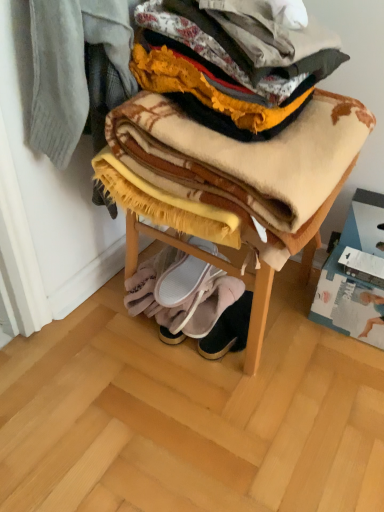
At what (x,y) coordinates should I click in order to perform the action: click on soft yellow fleece blanket at lower center, which is the 2th blanket from top to bottom. Please return your answer as a coordinate pair (x, y). Image resolution: width=384 pixels, height=512 pixels. Looking at the image, I should click on (181, 292).

What do you see at coordinates (230, 67) in the screenshot?
I see `plaid woolen blanket at center, acting as the 1th blanket starting from the top` at bounding box center [230, 67].

This screenshot has width=384, height=512. What do you see at coordinates (213, 306) in the screenshot?
I see `white fabric slipper at lower center, which ranks as the second footwear in bottom-to-top order` at bounding box center [213, 306].

At what (x,y) coordinates should I click in order to perform the action: click on soft yellow fleece blanket at lower center, which is the 2th blanket from top to bottom. Please return your answer as a coordinate pair (x, y). The image size is (384, 512). Looking at the image, I should click on (181, 292).

Considering the positions of points (205, 301) and (242, 310), is point (205, 301) closer to camera compared to point (242, 310)?

Yes, point (205, 301) is in front of point (242, 310).

From a real-world perspective, is white fabric slipper at lower center, which ranks as the second footwear in bottom-to-top order, above or below leather suede booties at lower center, positioned as the 1th footwear in bottom-to-top order?

white fabric slipper at lower center, which ranks as the second footwear in bottom-to-top order, is situated higher than leather suede booties at lower center, positioned as the 1th footwear in bottom-to-top order, in the real world.

Is white fabric slipper at lower center, the second footwear viewed from the top, turned away from leather suede booties at lower center, the third footwear viewed from the top?

No, white fabric slipper at lower center, the second footwear viewed from the top,'s orientation is not away from leather suede booties at lower center, the third footwear viewed from the top.

Is white fabric slipper at lower center, the second footwear viewed from the top, not inside leather suede booties at lower center, positioned as the 1th footwear in bottom-to-top order?

Yes, white fabric slipper at lower center, the second footwear viewed from the top, is located beyond the bounds of leather suede booties at lower center, positioned as the 1th footwear in bottom-to-top order.

Find the location of a particular element. footwear that is the 2nd object above the leather suede booties at lower center, the third footwear viewed from the top (from a real-world perspective) is located at coordinates (184, 280).

Considering the sizes of leather suede booties at lower center, the third footwear viewed from the top, and white suede slippers at lower center, positioned as the first footwear in top-to-bottom order, in the image, is leather suede booties at lower center, the third footwear viewed from the top, wider or thinner than white suede slippers at lower center, positioned as the first footwear in top-to-bottom order,?

Clearly, leather suede booties at lower center, the third footwear viewed from the top, has less width compared to white suede slippers at lower center, positioned as the first footwear in top-to-bottom order.

Is leather suede booties at lower center, positioned as the 1th footwear in bottom-to-top order, taller than white suede slippers at lower center, positioned as the first footwear in top-to-bottom order?

No.

From the image's perspective, is leather suede booties at lower center, the third footwear viewed from the top, under white suede slippers at lower center, which is the 3th footwear in bottom-to-top order?

Indeed, from the image's perspective, leather suede booties at lower center, the third footwear viewed from the top, is shown beneath white suede slippers at lower center, which is the 3th footwear in bottom-to-top order.

Is point (236, 108) closer to viewer compared to point (248, 312)?

Yes, point (236, 108) is closer to viewer.

How different are the orientations of plaid woolen blanket at center, which is counted as the first blanket, starting from the front, and leather suede booties at lower center, positioned as the 1th footwear in bottom-to-top order, in degrees?

There is a 88.3-degree angle between the facing directions of plaid woolen blanket at center, which is counted as the first blanket, starting from the front, and leather suede booties at lower center, positioned as the 1th footwear in bottom-to-top order.

Considering the relative sizes of plaid woolen blanket at center, which is counted as the first blanket, starting from the front, and leather suede booties at lower center, the third footwear viewed from the top, in the image provided, is plaid woolen blanket at center, which is counted as the first blanket, starting from the front, shorter than leather suede booties at lower center, the third footwear viewed from the top,?

No, plaid woolen blanket at center, which is counted as the first blanket, starting from the front, is not shorter than leather suede booties at lower center, the third footwear viewed from the top.

Would you say plaid woolen blanket at center, acting as the 1th blanket starting from the top, is a long distance from leather suede booties at lower center, positioned as the 1th footwear in bottom-to-top order?

No, plaid woolen blanket at center, acting as the 1th blanket starting from the top, is in close proximity to leather suede booties at lower center, positioned as the 1th footwear in bottom-to-top order.

Does point (184, 326) appear closer or farther from the camera than point (344, 152)?

Point (184, 326) appears to be farther away from the viewer than point (344, 152).

Is white fabric slipper at lower center, which ranks as the second footwear in bottom-to-top order, smaller than soft woolen blanket at center?

Indeed, white fabric slipper at lower center, which ranks as the second footwear in bottom-to-top order, has a smaller size compared to soft woolen blanket at center.

Which is more to the left, plaid woolen blanket at center, acting as the 1th blanket starting from the top, or soft woolen blanket at center?

plaid woolen blanket at center, acting as the 1th blanket starting from the top.

From the image's perspective, which one is positioned higher, plaid woolen blanket at center, acting as the 1th blanket starting from the top, or soft woolen blanket at center?

plaid woolen blanket at center, acting as the 1th blanket starting from the top.

Is plaid woolen blanket at center, which is counted as the 2th blanket, starting from the back, wider than soft woolen blanket at center?

No, plaid woolen blanket at center, which is counted as the 2th blanket, starting from the back, is not wider than soft woolen blanket at center.

From a real-world perspective, relative to soft woolen blanket at center, is plaid woolen blanket at center, the 2th blanket in the bottom-to-top sequence, vertically above or below?

In terms of real-world spatial position, plaid woolen blanket at center, the 2th blanket in the bottom-to-top sequence, is above soft woolen blanket at center.

Identify the location of footwear that is the 1st object located in front of the soft yellow fleece blanket at lower center, which is the 2th blanket from top to bottom. click(184, 280).

Could white suede slippers at lower center, which is the 3th footwear in bottom-to-top order, be considered to be inside soft yellow fleece blanket at lower center, which is the 2th blanket from top to bottom?

Yes, white suede slippers at lower center, which is the 3th footwear in bottom-to-top order, can be found within soft yellow fleece blanket at lower center, which is the 2th blanket from top to bottom.

Is soft yellow fleece blanket at lower center, marked as the 1th blanket in a bottom-to-top arrangement, facing towards white suede slippers at lower center, positioned as the first footwear in top-to-bottom order?

No, soft yellow fleece blanket at lower center, marked as the 1th blanket in a bottom-to-top arrangement, is not facing towards white suede slippers at lower center, positioned as the first footwear in top-to-bottom order.

Is soft yellow fleece blanket at lower center, marked as the 1th blanket in a bottom-to-top arrangement, not near white suede slippers at lower center, positioned as the first footwear in top-to-bottom order?

They are positioned close to each other.

From the image's perspective, who appears lower, soft yellow fleece blanket at lower center, which is the first blanket from back to front, or soft woolen blanket at center?

soft yellow fleece blanket at lower center, which is the first blanket from back to front.

Is soft yellow fleece blanket at lower center, marked as the 1th blanket in a bottom-to-top arrangement, looking in the opposite direction of soft woolen blanket at center?

No, soft yellow fleece blanket at lower center, marked as the 1th blanket in a bottom-to-top arrangement, is not facing the opposite direction of soft woolen blanket at center.

Which of these two, soft yellow fleece blanket at lower center, the 2th blanket positioned from the front, or soft woolen blanket at center, is bigger?

With larger size is soft woolen blanket at center.

How far apart are soft yellow fleece blanket at lower center, which is the first blanket from back to front, and soft woolen blanket at center?

soft yellow fleece blanket at lower center, which is the first blanket from back to front, is 7.76 inches away from soft woolen blanket at center.

The width and height of the screenshot is (384, 512). Find the location of `footwear located below the white fabric slipper at lower center, which ranks as the second footwear in bottom-to-top order (from the image's perspective)`. footwear located below the white fabric slipper at lower center, which ranks as the second footwear in bottom-to-top order (from the image's perspective) is located at coordinates (228, 330).

From the image's perspective, count 2nd footwears upward from the leather suede booties at lower center, positioned as the 1th footwear in bottom-to-top order, and point to it. Please provide its 2D coordinates.

[(184, 280)]

Estimate the real-world distances between objects in this image. Which object is further from leather suede booties at lower center, positioned as the 1th footwear in bottom-to-top order, white fabric slipper at lower center, which ranks as the second footwear in bottom-to-top order, or white suede slippers at lower center, which is the 3th footwear in bottom-to-top order?

white suede slippers at lower center, which is the 3th footwear in bottom-to-top order, lies further to leather suede booties at lower center, positioned as the 1th footwear in bottom-to-top order, than the other object.

Based on their spatial positions, is white fabric slipper at lower center, which ranks as the second footwear in bottom-to-top order, or plaid woolen blanket at center, acting as the 1th blanket starting from the top, further from soft woolen blanket at center?

white fabric slipper at lower center, which ranks as the second footwear in bottom-to-top order, is positioned further to the anchor soft woolen blanket at center.

Based on their spatial positions, is soft woolen blanket at center or soft yellow fleece blanket at lower center, marked as the 1th blanket in a bottom-to-top arrangement, closer to leather suede booties at lower center, positioned as the 1th footwear in bottom-to-top order?

Based on the image, soft yellow fleece blanket at lower center, marked as the 1th blanket in a bottom-to-top arrangement, appears to be nearer to leather suede booties at lower center, positioned as the 1th footwear in bottom-to-top order.

Considering their positions, is soft yellow fleece blanket at lower center, which is the 2th blanket from top to bottom, positioned further to white fabric slipper at lower center, which ranks as the second footwear in bottom-to-top order, than soft woolen blanket at center?

soft woolen blanket at center.

Considering their positions, is white fabric slipper at lower center, the second footwear viewed from the top, positioned further to soft yellow fleece blanket at lower center, which is the 2th blanket from top to bottom, than white suede slippers at lower center, which is the 3th footwear in bottom-to-top order?

white fabric slipper at lower center, the second footwear viewed from the top, is further to soft yellow fleece blanket at lower center, which is the 2th blanket from top to bottom.

Which object lies nearer to the anchor point plaid woolen blanket at center, the 2th blanket in the bottom-to-top sequence, soft yellow fleece blanket at lower center, which is the first blanket from back to front, or leather suede booties at lower center, the third footwear viewed from the top?

soft yellow fleece blanket at lower center, which is the first blanket from back to front, lies closer to plaid woolen blanket at center, the 2th blanket in the bottom-to-top sequence, than the other object.

Estimate the real-world distances between objects in this image. Which object is closer to soft yellow fleece blanket at lower center, marked as the 1th blanket in a bottom-to-top arrangement, leather suede booties at lower center, the third footwear viewed from the top, or plaid woolen blanket at center, which is counted as the 2th blanket, starting from the back?

leather suede booties at lower center, the third footwear viewed from the top, is positioned closer to the anchor soft yellow fleece blanket at lower center, marked as the 1th blanket in a bottom-to-top arrangement.

Estimate the real-world distances between objects in this image. Which object is closer to soft woolen blanket at center, plaid woolen blanket at center, which is counted as the 2th blanket, starting from the back, or leather suede booties at lower center, the third footwear viewed from the top?

plaid woolen blanket at center, which is counted as the 2th blanket, starting from the back, lies closer to soft woolen blanket at center than the other object.

This screenshot has height=512, width=384. Find the location of `footwear between white suede slippers at lower center, positioned as the first footwear in top-to-bottom order, and leather suede booties at lower center, positioned as the 1th footwear in bottom-to-top order, in the vertical direction`. footwear between white suede slippers at lower center, positioned as the first footwear in top-to-bottom order, and leather suede booties at lower center, positioned as the 1th footwear in bottom-to-top order, in the vertical direction is located at coordinates (213, 306).

At what (x,y) coordinates should I click in order to perform the action: click on footwear between plaid woolen blanket at center, which is counted as the 2th blanket, starting from the back, and soft yellow fleece blanket at lower center, which is the 2th blanket from top to bottom, from top to bottom. Please return your answer as a coordinate pair (x, y). This screenshot has width=384, height=512. Looking at the image, I should click on (184, 280).

This screenshot has height=512, width=384. In order to click on furniture positioned between plaid woolen blanket at center, the 2th blanket in the bottom-to-top sequence, and white suede slippers at lower center, positioned as the first footwear in top-to-bottom order, from near to far in this screenshot , I will do `click(248, 174)`.

Where is `blanket between plaid woolen blanket at center, acting as the 1th blanket starting from the top, and leather suede booties at lower center, the third footwear viewed from the top, in the up-down direction`? blanket between plaid woolen blanket at center, acting as the 1th blanket starting from the top, and leather suede booties at lower center, the third footwear viewed from the top, in the up-down direction is located at coordinates [x=181, y=292].